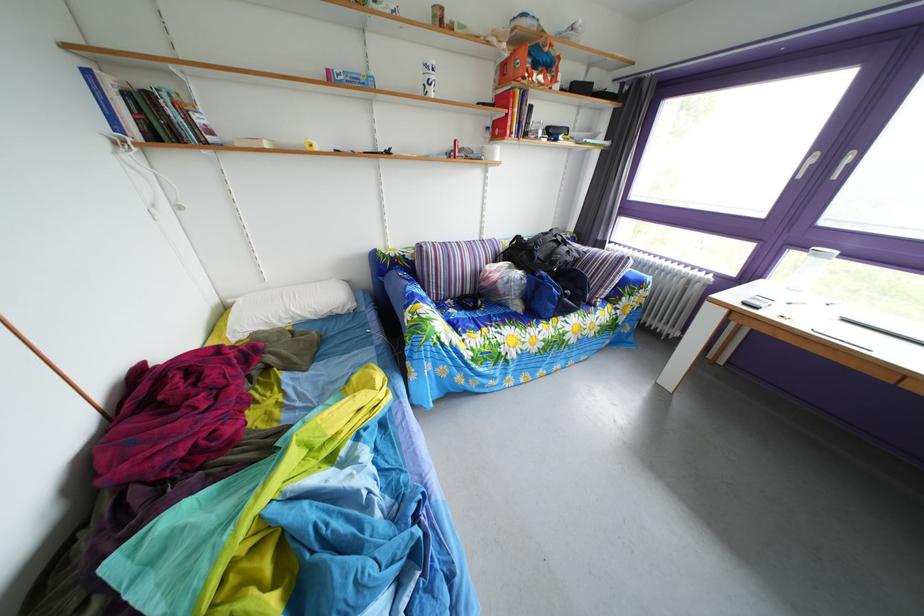
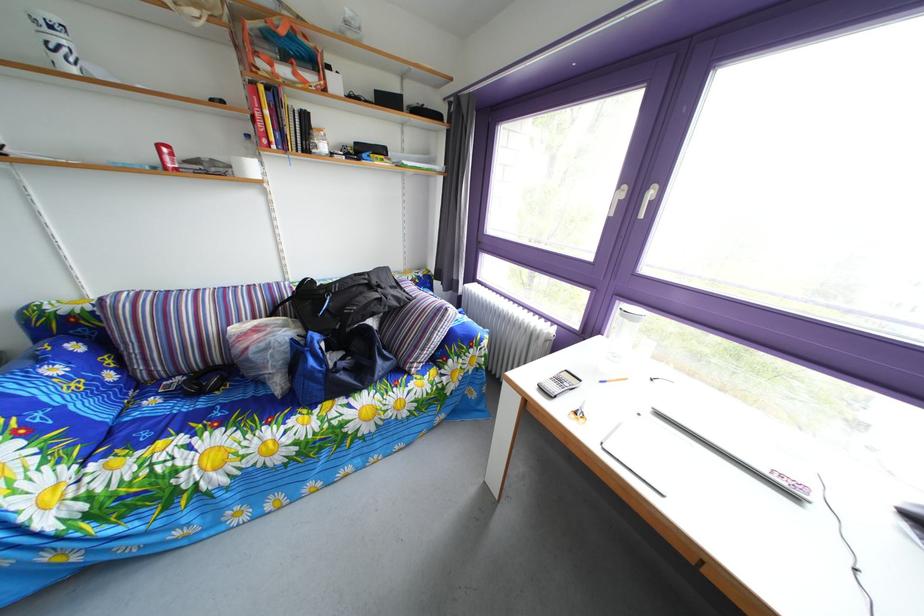
The images are taken continuously from a first-person perspective. In which direction are you moving?

The movement direction of the cameraman is right, forward.